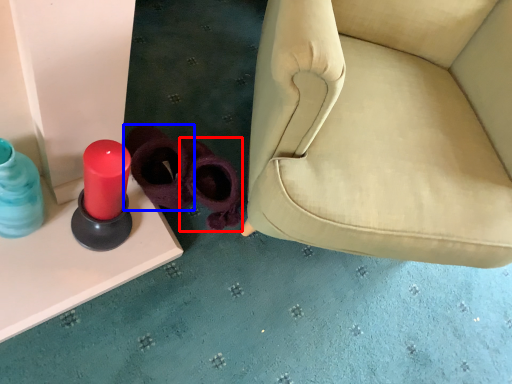
Question: Which object appears closest to the camera in this image, footwear (highlighted by a red box) or footwear (highlighted by a blue box)?

Choices:
 (A) footwear
 (B) footwear

Answer: (B)